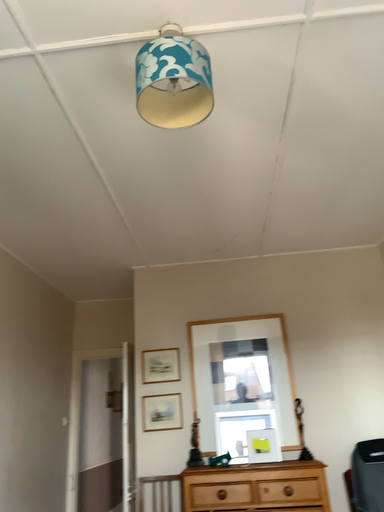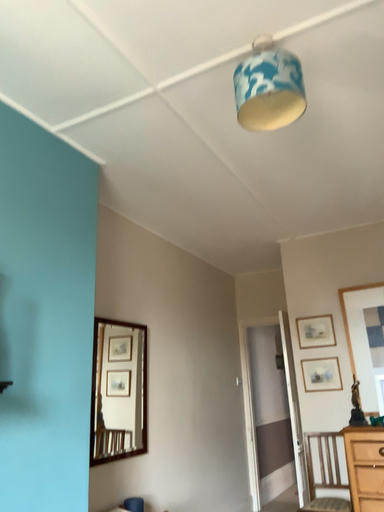
Question: Which way did the camera rotate in the video?

Choices:
 (A) rotated left
 (B) rotated right

Answer: (A)